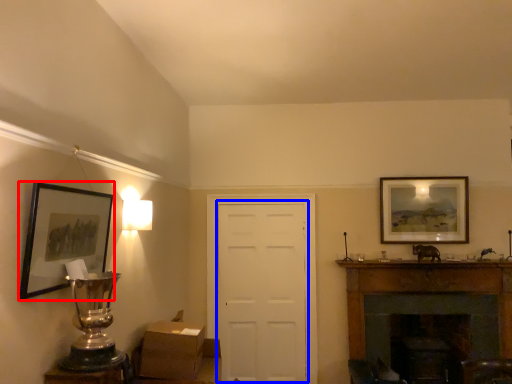
Question: Which of the following is the farthest to the observer, picture frame (highlighted by a red box) or door (highlighted by a blue box)?

Choices:
 (A) picture frame
 (B) door

Answer: (B)